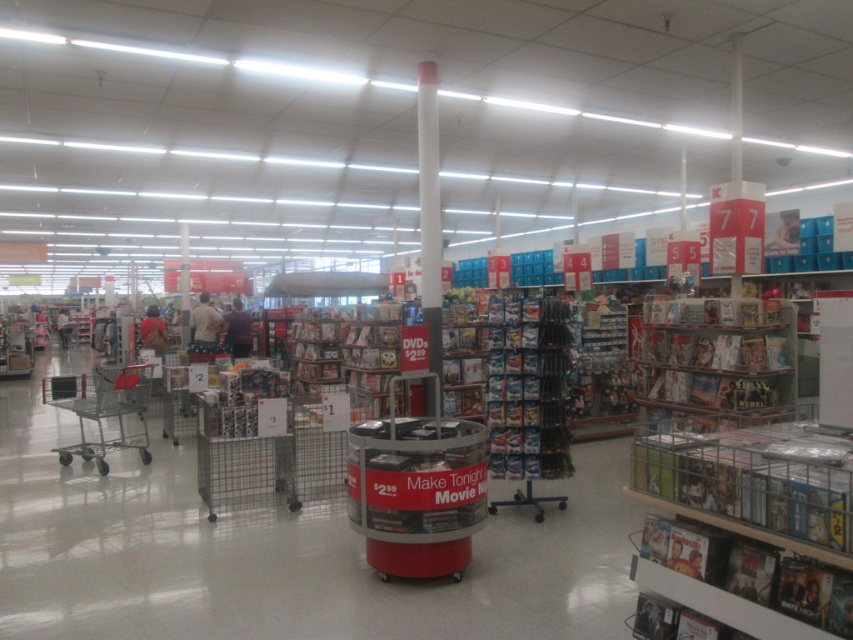
Is point (410, 435) more distant than point (779, 376)?

That is False.

Does metallic silver shopping cart at center lie behind metallic silver shelves at right?

No, metallic silver shopping cart at center is closer to the viewer.

Where is `metallic silver shopping cart at center`? The height and width of the screenshot is (640, 853). metallic silver shopping cart at center is located at coordinates (416, 488).

Who is more distant from viewer, [720,384] or [61,461]?

Positioned behind is point [61,461].

Does metallic silver shelves at right have a lesser height compared to silver metallic shopping cart at left?

No, metallic silver shelves at right is not shorter than silver metallic shopping cart at left.

Between point (740, 371) and point (102, 438), which one is positioned behind?

Positioned behind is point (102, 438).

Locate an element on the screen. Image resolution: width=853 pixels, height=640 pixels. metallic silver shelves at right is located at coordinates (715, 356).

Consider the image. Is metallic silver shopping cart at center thinner than silver metallic shopping cart at left?

Yes.

Which is above, metallic silver shopping cart at center or silver metallic shopping cart at left?

Positioned higher is metallic silver shopping cart at center.

The width and height of the screenshot is (853, 640). I want to click on metallic silver shopping cart at center, so click(416, 488).

This screenshot has width=853, height=640. Identify the location of metallic silver shopping cart at center. (416, 488).